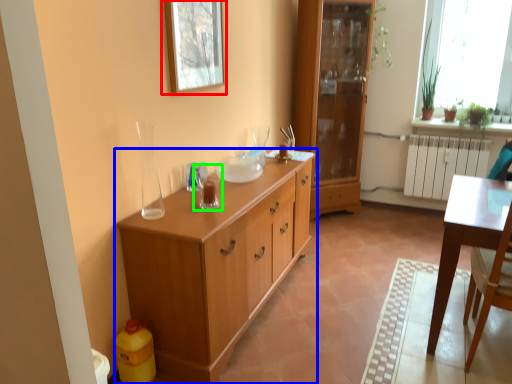
Question: Which is nearer to the picture frame (highlighted by a red box)? chest of drawers (highlighted by a blue box) or tableware (highlighted by a green box).

Choices:
 (A) chest of drawers
 (B) tableware

Answer: (B)